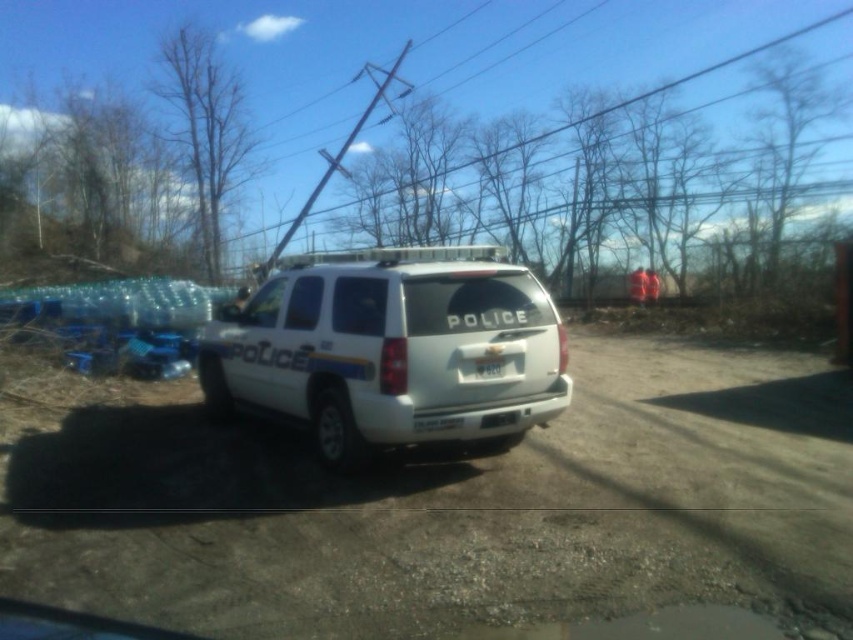
The height and width of the screenshot is (640, 853). Describe the element at coordinates (454, 509) in the screenshot. I see `white gravel dirt track at center` at that location.

Does white gravel dirt track at center appear under white matte police suv at center?

Indeed, white gravel dirt track at center is positioned under white matte police suv at center.

What do you see at coordinates (454, 509) in the screenshot? The width and height of the screenshot is (853, 640). I see `white gravel dirt track at center` at bounding box center [454, 509].

The width and height of the screenshot is (853, 640). What are the coordinates of `white gravel dirt track at center` in the screenshot? It's located at (454, 509).

Does white gravel dirt track at center appear on the right side of white plastic license plate at center?

In fact, white gravel dirt track at center is to the left of white plastic license plate at center.

Who is positioned more to the right, white gravel dirt track at center or white plastic license plate at center?

Positioned to the right is white plastic license plate at center.

Who is more forward, [263,545] or [488,368]?

Point [263,545] is more forward.

This screenshot has height=640, width=853. I want to click on white gravel dirt track at center, so click(x=454, y=509).

Can you confirm if white matte police suv at center is wider than white plastic license plate at center?

Correct, the width of white matte police suv at center exceeds that of white plastic license plate at center.

Between white matte police suv at center and white plastic license plate at center, which one appears on the right side from the viewer's perspective?

From the viewer's perspective, white matte police suv at center appears more on the right side.

Which is behind, point (407, 364) or point (486, 364)?

The point (486, 364) is behind.

Where is `white matte police suv at center`? The image size is (853, 640). white matte police suv at center is located at coordinates (392, 349).